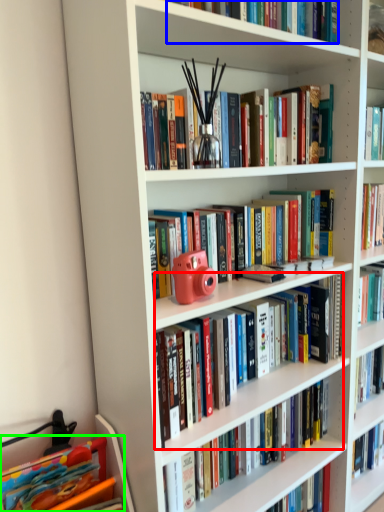
Question: Estimate the real-world distances between objects in this image. Which object is closer to book (highlighted by a red box), book (highlighted by a blue box) or book (highlighted by a green box)?

Choices:
 (A) book
 (B) book

Answer: (B)